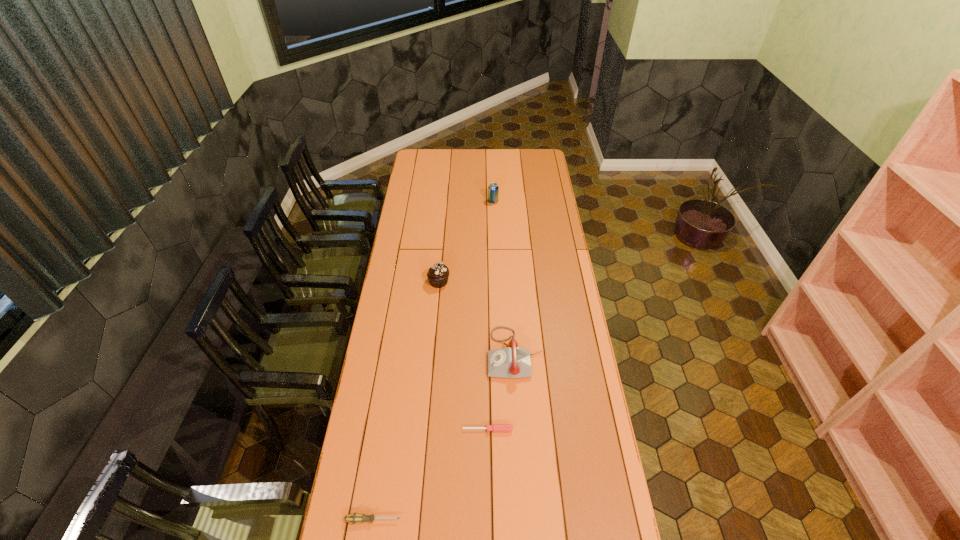
Where is `beer can`? The image size is (960, 540). beer can is located at coordinates (493, 189).

Where is `the fourth nearest object`? The height and width of the screenshot is (540, 960). the fourth nearest object is located at coordinates (438, 274).

Locate an element on the screen. The width and height of the screenshot is (960, 540). the third tallest object is located at coordinates (512, 362).

The height and width of the screenshot is (540, 960). I want to click on the third farthest object, so click(x=512, y=362).

Identify the location of the nearest object. This screenshot has width=960, height=540. (354, 518).

Locate an element on the screen. The image size is (960, 540). the taller screwdriver is located at coordinates (354, 518).

Find the location of a particular element. This screenshot has height=540, width=960. the right screwdriver is located at coordinates pos(495,427).

Where is `the second nearest object`? The height and width of the screenshot is (540, 960). the second nearest object is located at coordinates pyautogui.click(x=495, y=427).

This screenshot has width=960, height=540. Find the location of `vacant space located on the left of the beer can`. vacant space located on the left of the beer can is located at coordinates (477, 201).

You are a GUI agent. You are given a task and a screenshot of the screen. Output one action in this format:
    pyautogui.click(x=<x>, y=<y>)
    Task: Click on the vacant space located on the front of the second farthest object
    
    Given the screenshot: What is the action you would take?
    pyautogui.click(x=432, y=357)